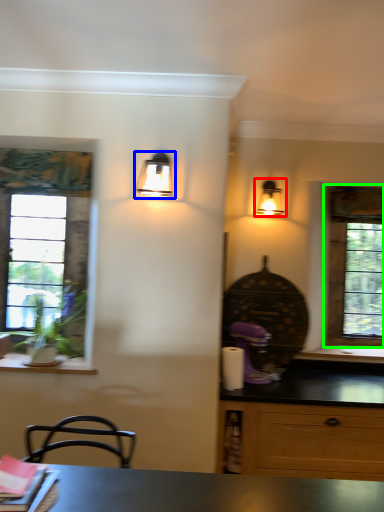
Question: Based on their relative distances, which object is nearer to lamp (highlighted by a red box)? Choose from lamp (highlighted by a blue box) and window (highlighted by a green box).

Choices:
 (A) lamp
 (B) window

Answer: (B)